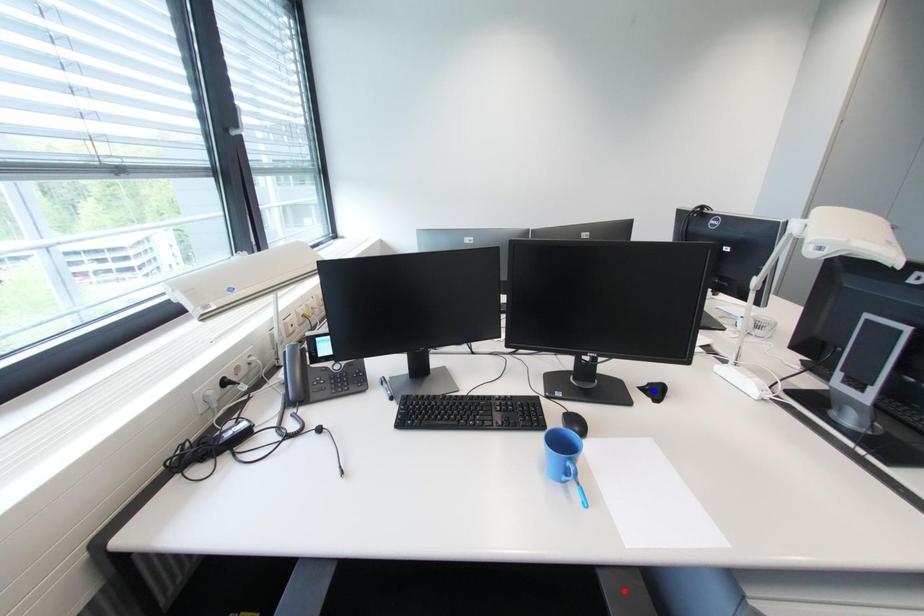
Question: Which of the two points in the image is closer to the camera?

Choices:
 (A) Blue point is closer.
 (B) Red point is closer.

Answer: (B)